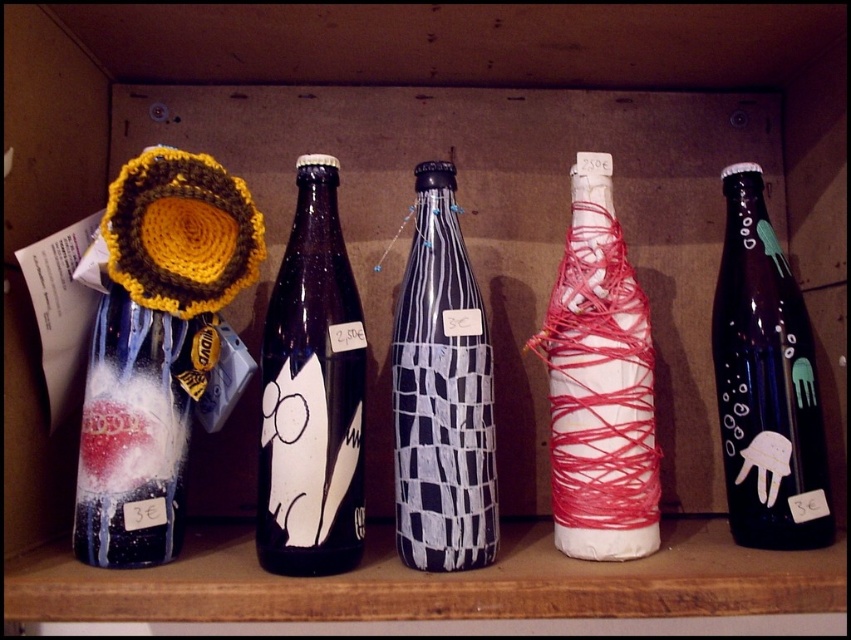
Question: Which point appears farthest from the camera in this image?

Choices:
 (A) (414, 500)
 (B) (135, 330)
 (C) (20, 611)

Answer: (B)

Question: Does matte black bottles at center have a lesser width compared to matte black and white checkered bottle at center?

Choices:
 (A) yes
 (B) no

Answer: (B)

Question: Is matte black bottle at center to the right of matte black and white checkered bottle at center from the viewer's perspective?

Choices:
 (A) yes
 (B) no

Answer: (B)

Question: Does matte black bottles at center have a lesser width compared to white yarn wrapped bottle at center?

Choices:
 (A) no
 (B) yes

Answer: (A)

Question: Among these objects, which one is nearest to the camera?

Choices:
 (A) glittery painted bottle at left
 (B) matte black bottle at right
 (C) matte black and white checkered bottle at center

Answer: (A)

Question: Among these objects, which one is nearest to the camera?

Choices:
 (A) white yarn wrapped bottle at center
 (B) matte black bottle at center

Answer: (B)